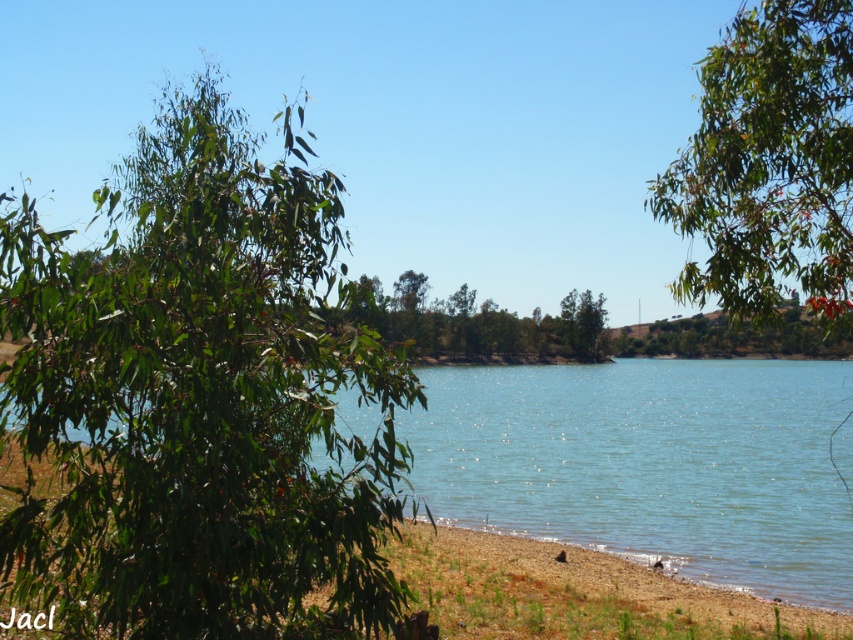
Is the position of clear blue water at center more distant than that of green glossy leaves at upper right?

Yes.

Does clear blue water at center appear on the right side of green glossy leaves at upper right?

Yes, clear blue water at center is to the right of green glossy leaves at upper right.

Identify the location of clear blue water at center. The height and width of the screenshot is (640, 853). (650, 464).

Identify the location of clear blue water at center. This screenshot has width=853, height=640. (650, 464).

Is point (730, 180) positioned after point (363, 285)?

No, it is not.

Is green glossy leaves at upper right further to the viewer compared to green leafy tree at center?

Yes, it is behind green leafy tree at center.

Which is behind, point (819, 109) or point (450, 308)?

The point (450, 308) is behind.

This screenshot has width=853, height=640. Identify the location of green glossy leaves at upper right. (769, 164).

Can you confirm if green leafy tree at left is wider than clear blue water at center?

No.

Describe the element at coordinates (196, 401) in the screenshot. I see `green leafy tree at left` at that location.

What are the coordinates of `green leafy tree at left` in the screenshot? It's located at (196, 401).